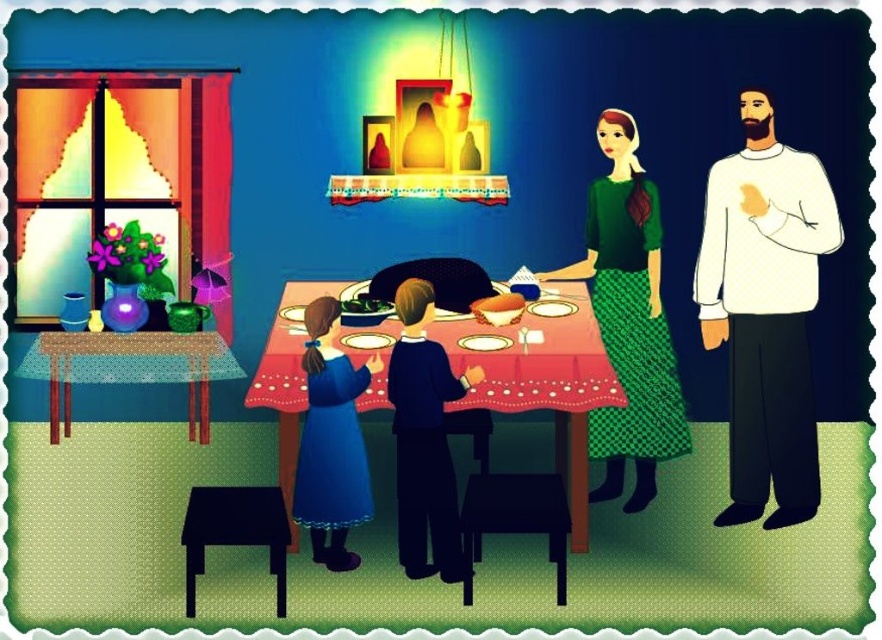
You are a guest at this family gathering and want to place a small gift on the table between the white matte sweater at right and the smooth red tablecloth at center. Can you do that?

The white matte sweater at right is positioned on the right side of the smooth red tablecloth at center, so there is space between them where you can place your gift.